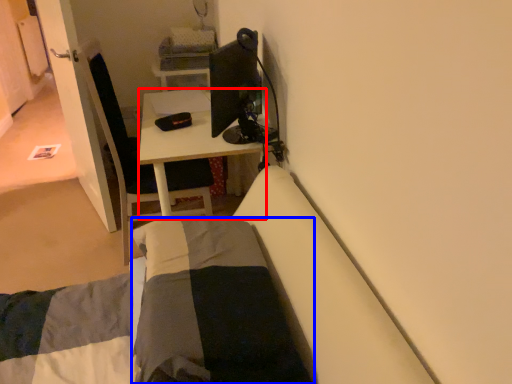
Question: Which point is closer to the camera, desk (highlighted by a red box) or blanket (highlighted by a blue box)?

Choices:
 (A) desk
 (B) blanket

Answer: (B)